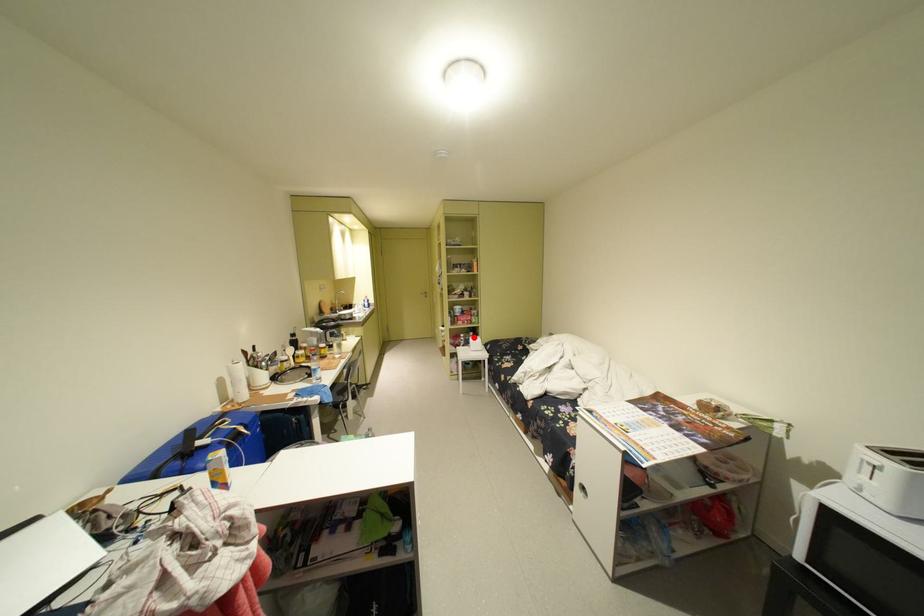
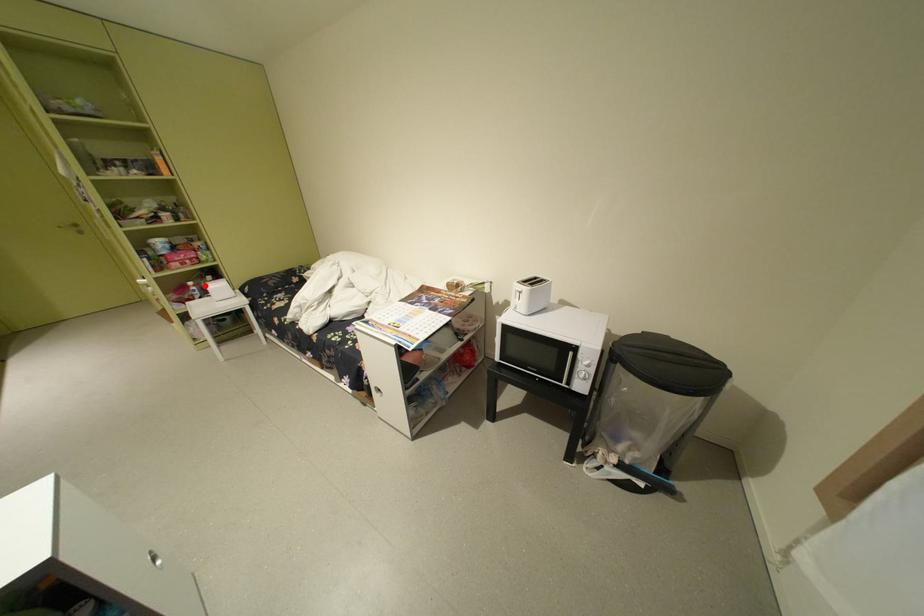
I am providing you with two images of the same scene from different viewpoints. A red point is marked on the first image and another point is marked on the second image. Is the marked point in image1 the same physical position as the marked point in image2?

Yes